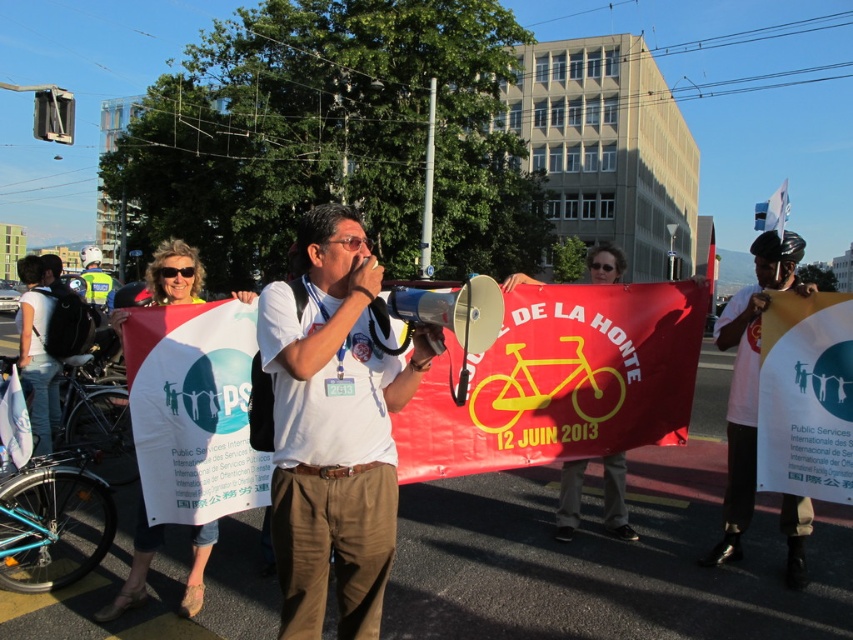
Question: Does white paper sign at center have a lesser width compared to yellow paper banner at center?

Choices:
 (A) no
 (B) yes

Answer: (A)

Question: Which of these objects is positioned closest to the white paper banner at center?

Choices:
 (A) white cotton shirt at center
 (B) white fabric banner at center
 (C) yellow paper banner at center
 (D) white paper sign at center

Answer: (D)

Question: Can you confirm if white paper banner at center is smaller than yellow paper banner at center?

Choices:
 (A) yes
 (B) no

Answer: (A)

Question: Can you confirm if white paper banner at center is wider than white fabric banner at center?

Choices:
 (A) no
 (B) yes

Answer: (A)

Question: Which point is closer to the camera taking this photo?

Choices:
 (A) (793, 362)
 (B) (730, 384)
 (C) (618, 488)
 (D) (146, 552)

Answer: (D)

Question: Which is farther from the white fabric banner at center?

Choices:
 (A) yellow paper banner at center
 (B) white paper sign at center

Answer: (A)